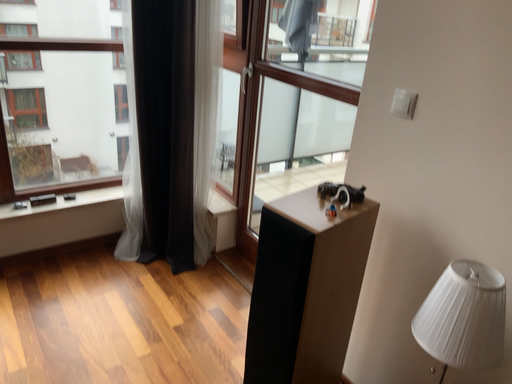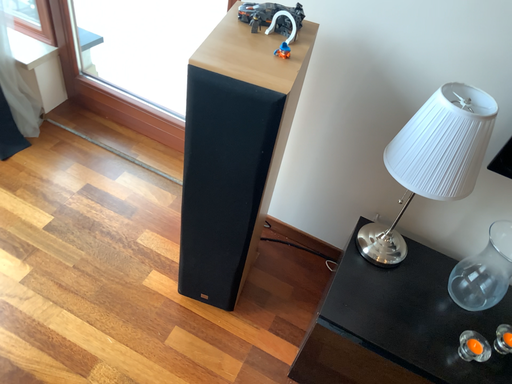
Question: Which way did the camera rotate in the video?

Choices:
 (A) rotated right
 (B) rotated left

Answer: (A)